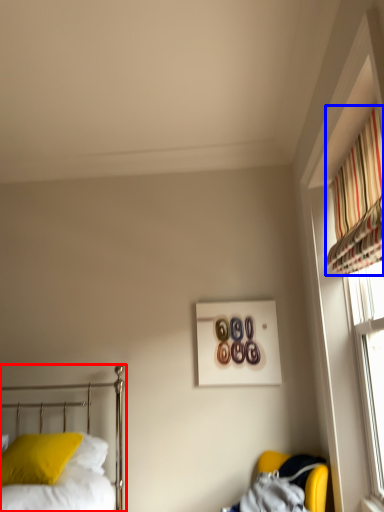
Question: Which object appears farthest to the camera in this image, bed (highlighted by a red box) or curtain (highlighted by a blue box)?

Choices:
 (A) bed
 (B) curtain

Answer: (B)